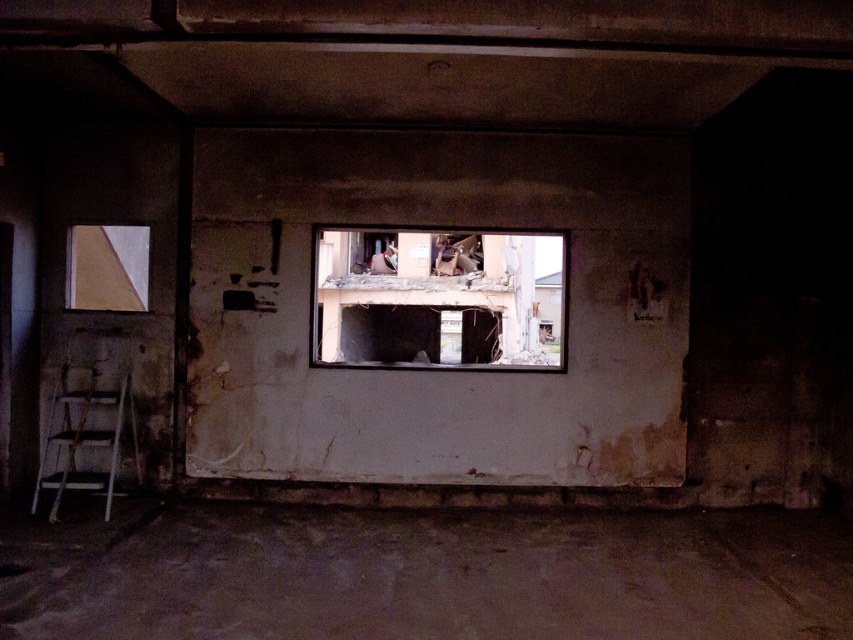
Does transparent glass window at center have a greater height compared to matte glass window at upper left?

Indeed, transparent glass window at center has a greater height compared to matte glass window at upper left.

Who is higher up, transparent glass window at center or matte glass window at upper left?

matte glass window at upper left is higher up.

Where is `transparent glass window at center`? The height and width of the screenshot is (640, 853). transparent glass window at center is located at coordinates (438, 298).

Image resolution: width=853 pixels, height=640 pixels. What are the coordinates of `transparent glass window at center` in the screenshot? It's located at (x=438, y=298).

Between transparent glass window at center and white wooden ladder at lower left, which one has more height?

Standing taller between the two is transparent glass window at center.

Is transparent glass window at center to the left of white wooden ladder at lower left from the viewer's perspective?

Incorrect, transparent glass window at center is not on the left side of white wooden ladder at lower left.

Is point (520, 284) in front of point (73, 454)?

That is False.

Where is `transparent glass window at center`? Image resolution: width=853 pixels, height=640 pixels. transparent glass window at center is located at coordinates (438, 298).

Based on the photo, does matte glass window at upper left have a greater width compared to white wooden ladder at lower left?

Incorrect, matte glass window at upper left's width does not surpass white wooden ladder at lower left's.

Based on the photo, is matte glass window at upper left positioned in front of white wooden ladder at lower left?

No, matte glass window at upper left is behind white wooden ladder at lower left.

Between point (120, 244) and point (97, 397), which one is positioned behind?

The point (120, 244) is more distant.

Find the location of a particular element. The image size is (853, 640). matte glass window at upper left is located at coordinates (108, 268).